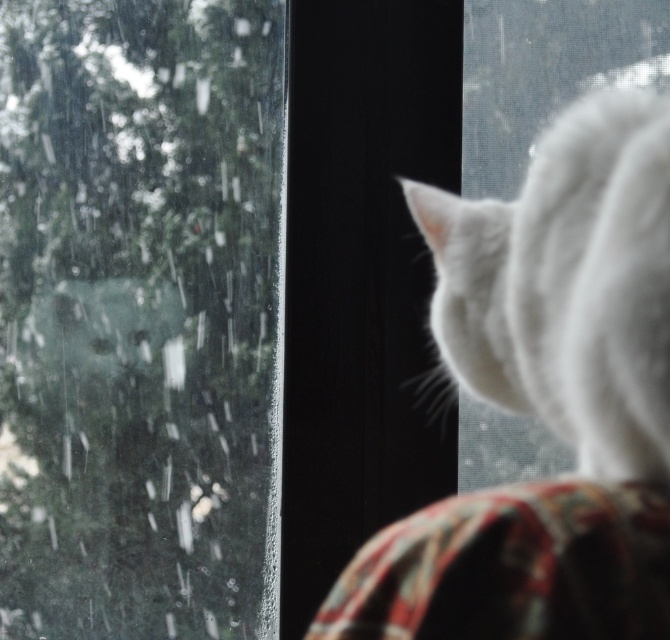
Does transparent glass window at upper left have a greater height compared to white fluffy cat at upper right?

Correct, transparent glass window at upper left is much taller as white fluffy cat at upper right.

Is transparent glass window at upper left further to camera compared to white fluffy cat at upper right?

Yes, transparent glass window at upper left is further from the viewer.

Is point (263, 442) positioned in front of point (586, 436)?

No, it is not.

Find the location of `transparent glass window at upper left`. transparent glass window at upper left is located at coordinates (135, 312).